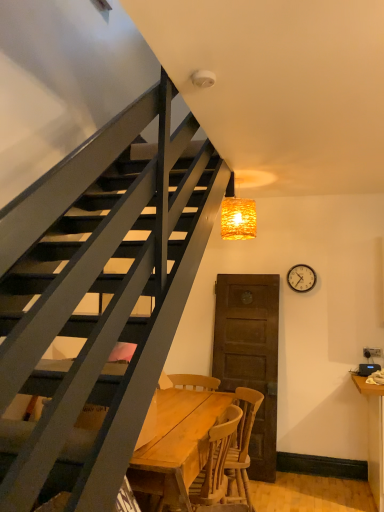
Question: In terms of height, does metallic silver clock at upper right look taller or shorter compared to woven golden light at upper center?

Choices:
 (A) short
 (B) tall

Answer: (A)

Question: Based on their positions, is metallic silver clock at upper right located to the left or right of woven golden light at upper center?

Choices:
 (A) right
 (B) left

Answer: (A)

Question: Which is nearer to the woven golden light at upper center?

Choices:
 (A) wooden table at center
 (B) metallic silver clock at upper right
 (C) wooden chair at center

Answer: (B)

Question: Considering the real-world distances, which object is farthest from the wooden table at center?

Choices:
 (A) wooden chair at center
 (B) metallic silver clock at upper right
 (C) woven golden light at upper center

Answer: (B)